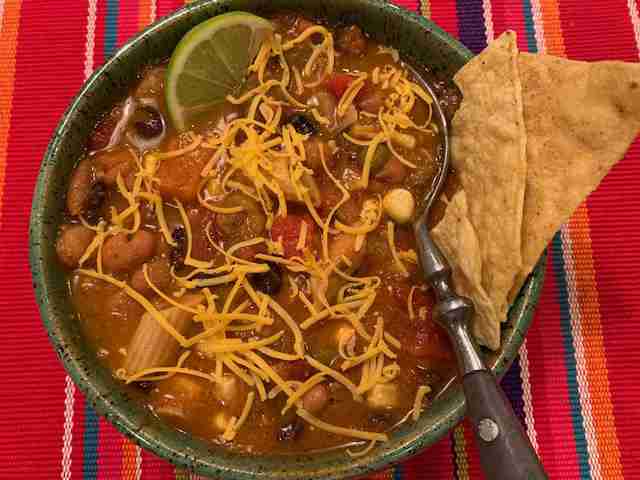
At what (x,y) coordinates should I click in order to perform the action: click on table cloth. Please return your answer as a coordinate pair (x, y). Looking at the image, I should click on (36, 84), (619, 348).